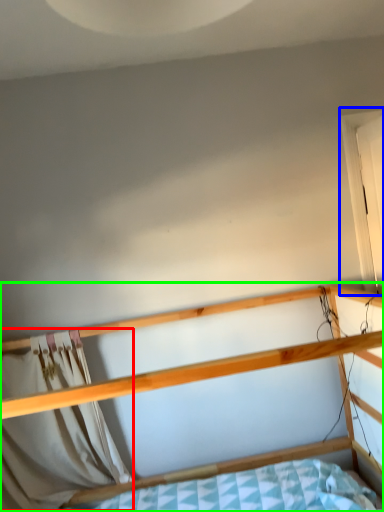
Question: Which object is the closest to the curtain (highlighted by a red box)? Choose among these: window (highlighted by a blue box) or bed (highlighted by a green box).

Choices:
 (A) window
 (B) bed

Answer: (B)